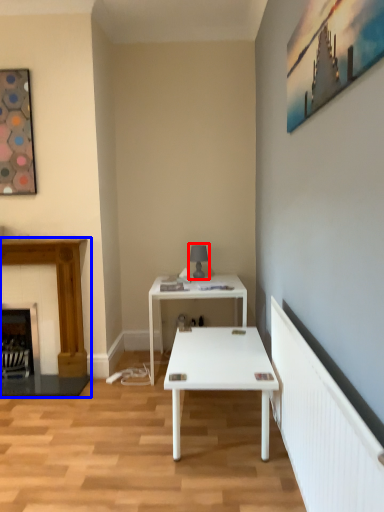
Question: Which object appears farthest to the camera in this image, table lamp (highlighted by a red box) or fireplace (highlighted by a blue box)?

Choices:
 (A) table lamp
 (B) fireplace

Answer: (A)